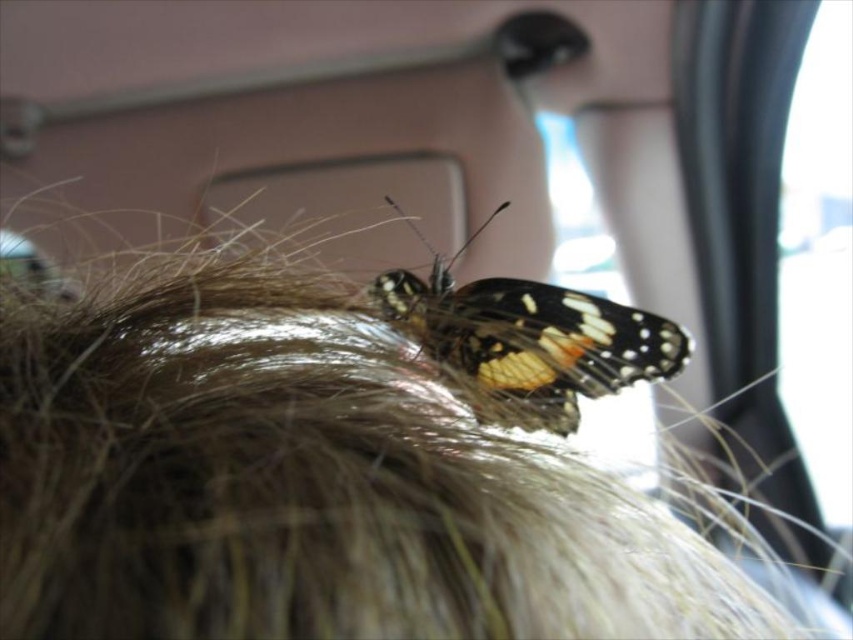
Question: Which point is farther from the camera taking this photo?

Choices:
 (A) pyautogui.click(x=486, y=284)
 (B) pyautogui.click(x=641, y=577)

Answer: (A)

Question: Which point is closer to the camera taking this photo?

Choices:
 (A) (668, 588)
 (B) (532, 356)

Answer: (A)

Question: Can you confirm if brown fuzzy hair at upper center is positioned to the right of shiny orange butterfly at center?

Choices:
 (A) yes
 (B) no

Answer: (B)

Question: Which of the following is the closest to the observer?

Choices:
 (A) brown fuzzy hair at upper center
 (B) shiny orange butterfly at center

Answer: (A)

Question: Does brown fuzzy hair at upper center come in front of shiny orange butterfly at center?

Choices:
 (A) no
 (B) yes

Answer: (B)

Question: Is brown fuzzy hair at upper center positioned at the back of shiny orange butterfly at center?

Choices:
 (A) no
 (B) yes

Answer: (A)